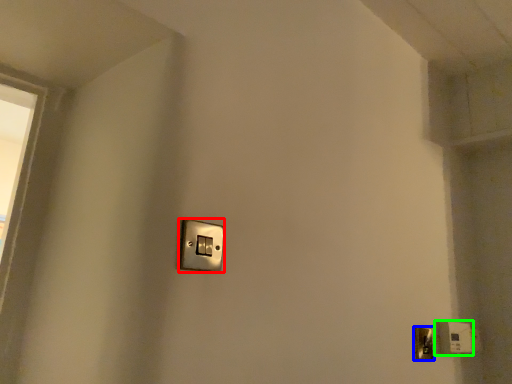
Question: Estimate the real-world distances between objects in this image. Which object is farther from light switch (highlighted by a red box), door handle (highlighted by a blue box) or light switch (highlighted by a green box)?

Choices:
 (A) door handle
 (B) light switch

Answer: (B)